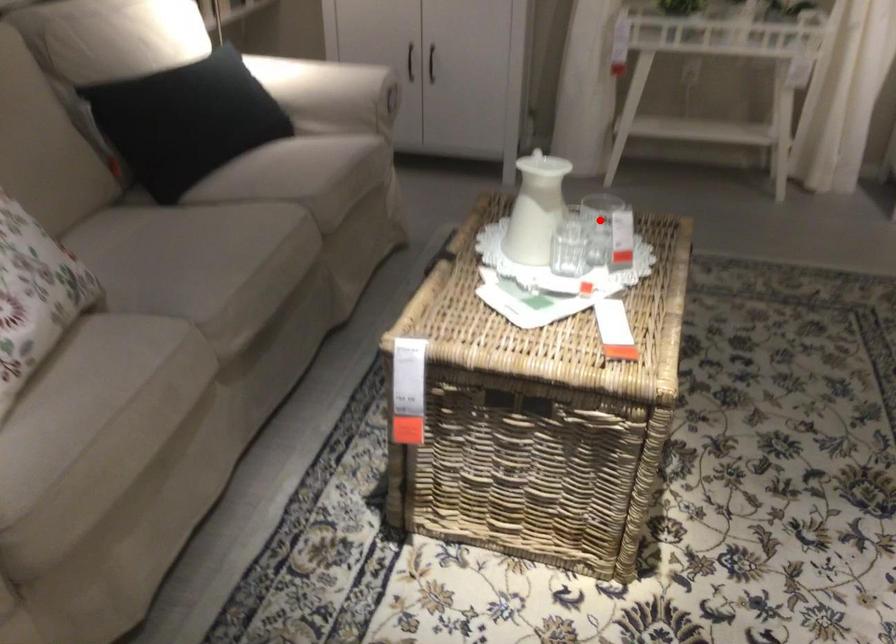
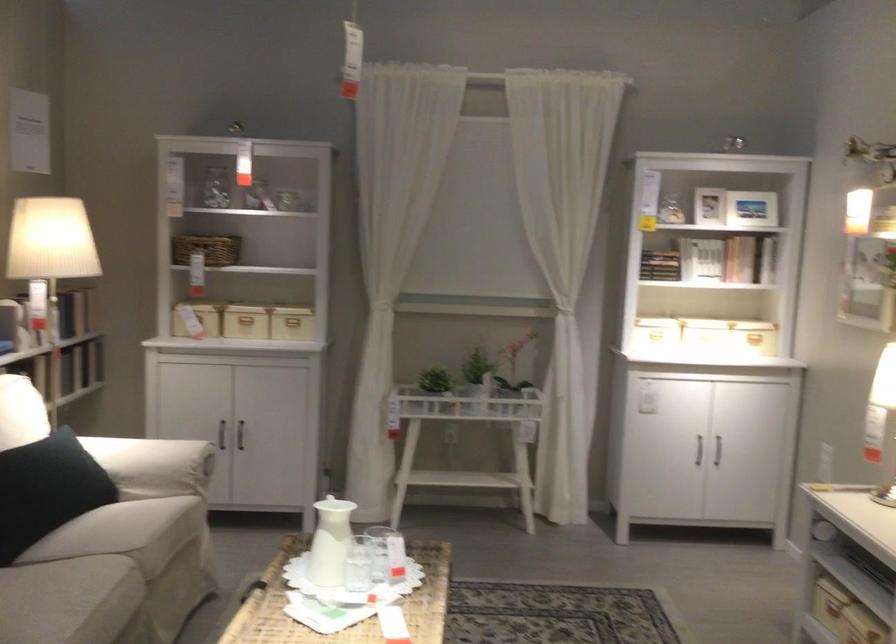
Question: I am providing you with two images of the same scene from different viewpoints. In image1, a red point is highlighted. Considering the same 3D point in image2, which of the following is correct?

Choices:
 (A) It is closer
 (B) It is farther

Answer: (B)